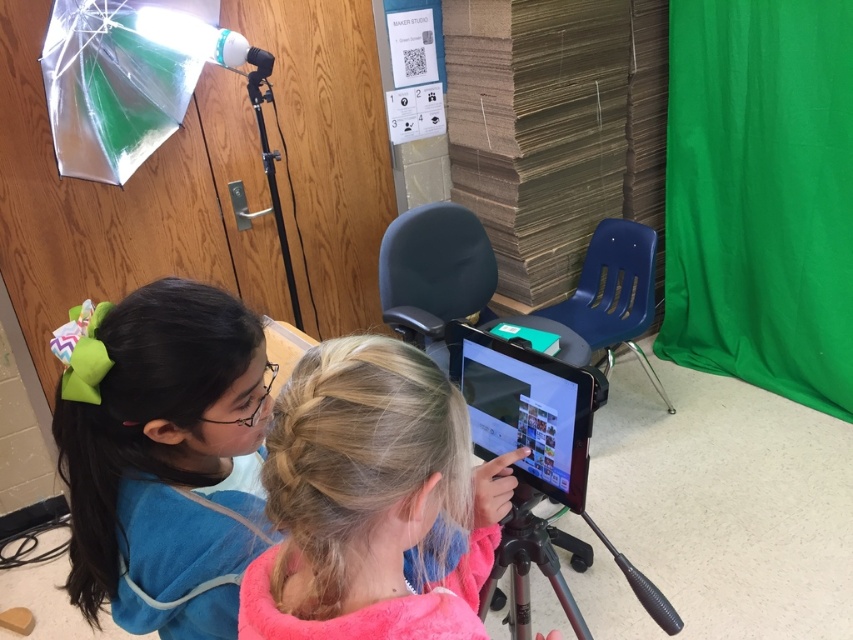
You are a student who needs to sit down. You see a point at coordinates (613, 292). Is there a chair near that point?

Yes, the point at coordinates (613, 292) is on a blue plastic chair at center, so there is a chair near that point.

You are a photographer setting up a shoot in this classroom. You need to position a large backdrop that requires 3 square feet of space. Given the current setup with the matte blue shirt at left and metallic tripod at center, which object might you need to move to accommodate the backdrop?

The metallic tripod at center occupies more space than the matte blue shirt at left, so moving the metallic tripod at center would free up enough space for the backdrop.

You are a photographer setting up for a group photo. You have a matte blue shirt at left and a metallic tripod at center in your frame. Which object should you adjust to ensure both fit within the camera frame?

Since the matte blue shirt at left might be wider than the metallic tripod at center, you should adjust the matte blue shirt at left to ensure both fit within the camera frame.